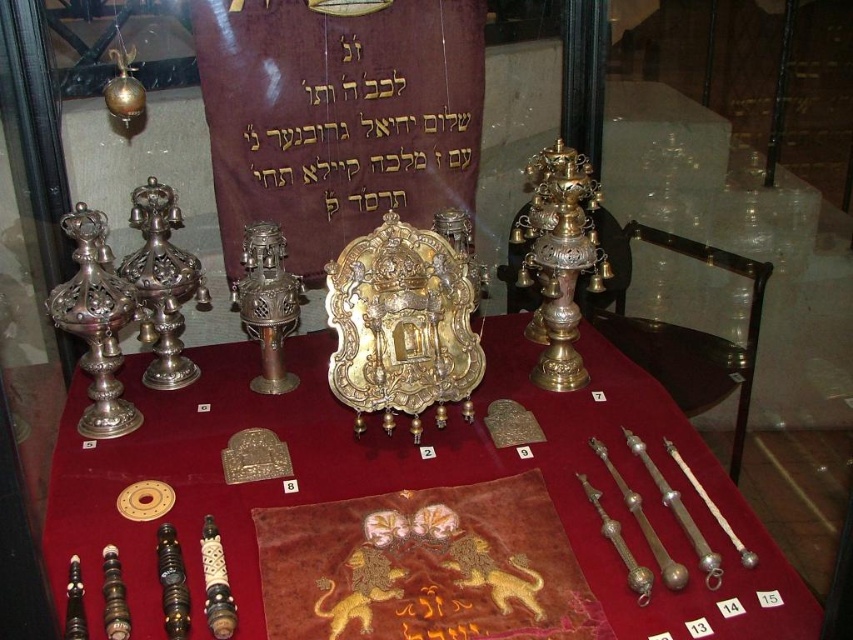
Is point (589, 353) less distant than point (404, 148)?

Yes.

Between point (587, 467) and point (354, 134), which one is positioned behind?

Positioned behind is point (354, 134).

Where is `shiny gold plate at center`? The width and height of the screenshot is (853, 640). shiny gold plate at center is located at coordinates (219, 472).